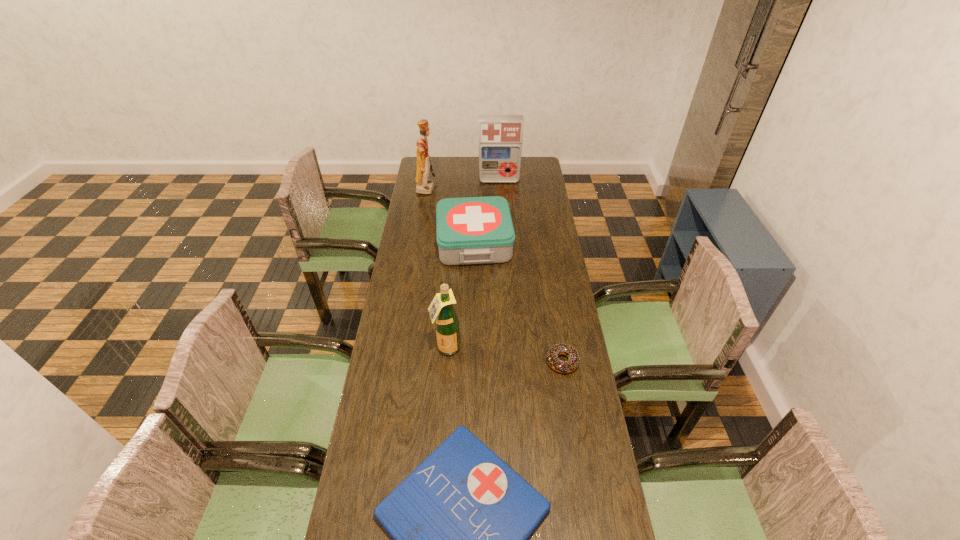
At what (x,y) coordinates should I click in order to perform the action: click on free space between the fourth nearest object and the doughnut. Please return your answer as a coordinate pair (x, y). The height and width of the screenshot is (540, 960). Looking at the image, I should click on [518, 302].

I want to click on free spot between the third shortest object and the doughnut, so click(x=518, y=302).

Image resolution: width=960 pixels, height=540 pixels. I want to click on object that is the closest to the tallest first-aid kit, so click(x=424, y=186).

You are a GUI agent. You are given a task and a screenshot of the screen. Output one action in this format:
    pyautogui.click(x=<x>, y=<y>)
    Task: Click on the object that is the fifth closest to the nutcracker
    This screenshot has width=960, height=540.
    Given the screenshot: What is the action you would take?
    pyautogui.click(x=460, y=522)

Choose which first-aid kit is the third nearest neighbor to the rightmost object. Please provide its 2D coordinates. Your answer should be formatted as a tuple, i.e. [(x, y)], where the tuple contains the x and y coordinates of a point satisfying the conditions above.

[(500, 136)]

Select which first-aid kit is the closest to the second farthest first-aid kit. Please provide its 2D coordinates. Your answer should be formatted as a tuple, i.e. [(x, y)], where the tuple contains the x and y coordinates of a point satisfying the conditions above.

[(500, 136)]

This screenshot has height=540, width=960. I want to click on blank area in the image that satisfies the following two spatial constraints: 1. on the front-facing side of the nutcracker; 2. on the left side of the third farthest object, so click(418, 244).

You are a GUI agent. You are given a task and a screenshot of the screen. Output one action in this format:
    pyautogui.click(x=<x>, y=<y>)
    Task: Click on the free space that satisfies the following two spatial constraints: 1. on the front-facing side of the liquor; 2. on the left side of the doughnut
    
    Given the screenshot: What is the action you would take?
    pyautogui.click(x=445, y=362)

Locate an element on the screen. blank space that satisfies the following two spatial constraints: 1. on the front-facing side of the liquor; 2. on the right side of the rightmost object is located at coordinates (445, 362).

You are a GUI agent. You are given a task and a screenshot of the screen. Output one action in this format:
    pyautogui.click(x=<x>, y=<y>)
    Task: Click on the vacant space that satisfies the following two spatial constraints: 1. on the front-facing side of the farthest first-aid kit; 2. on the front-facing side of the nutcracker
    Image resolution: width=960 pixels, height=540 pixels.
    Given the screenshot: What is the action you would take?
    pyautogui.click(x=499, y=188)